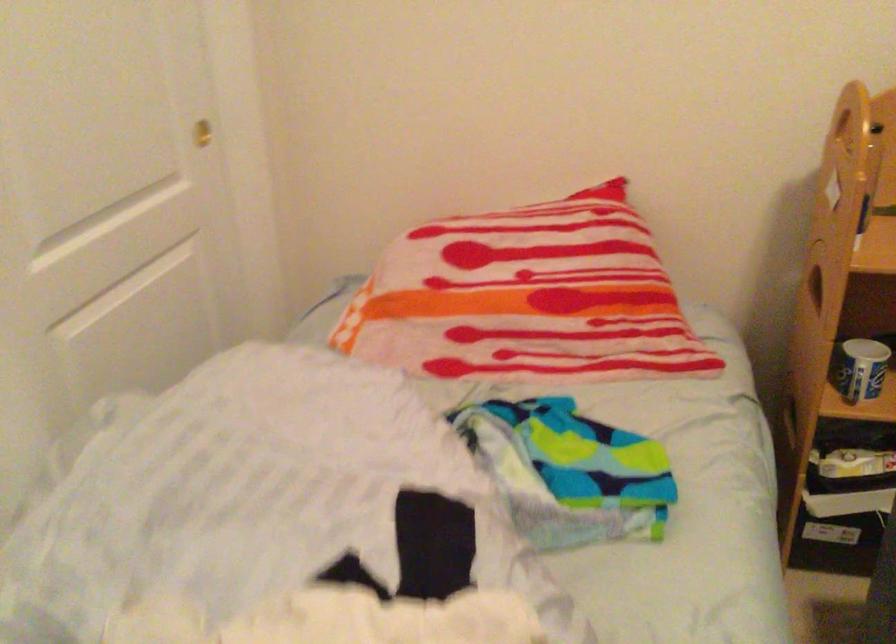
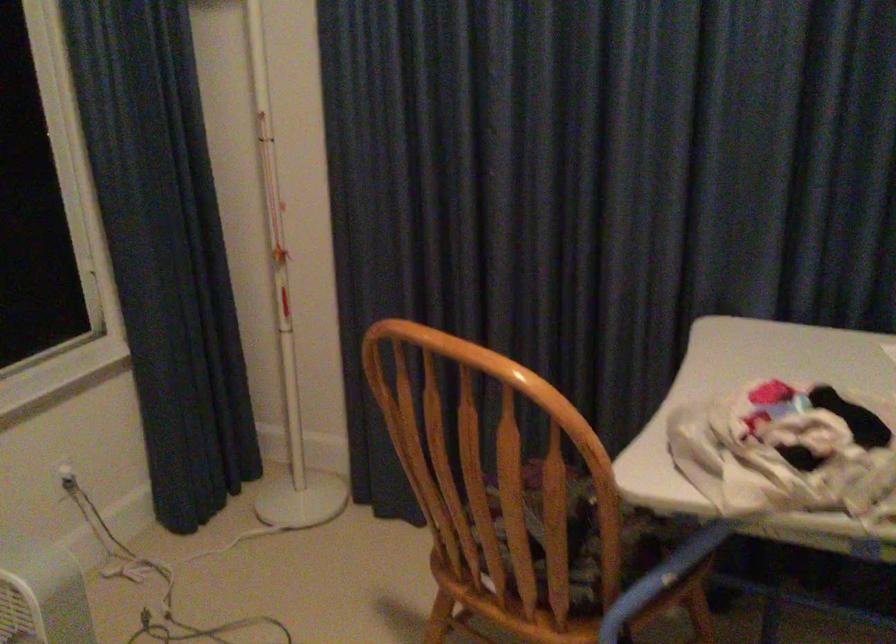
Question: The camera is either moving clockwise (left) or counter-clockwise (right) around the object. The first image is from the beginning of the video and the second image is from the end. Is the camera moving left or right when shooting the video?

Choices:
 (A) Left
 (B) Right

Answer: (A)